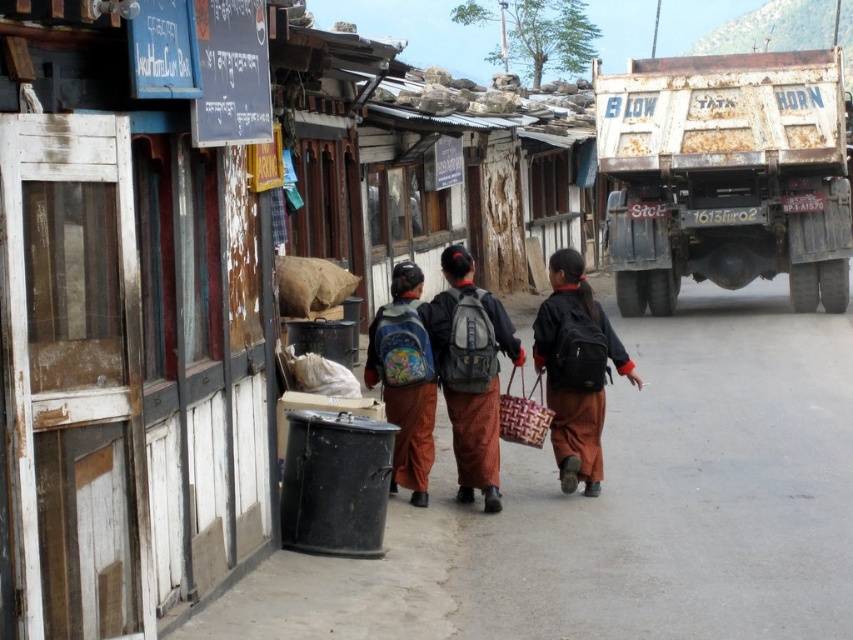
You are a delivery person who needs to place a package on the ground between the rusty metal truck at right and the matte black backpacks at center. Based on the scene description, where should you place the package so it is closer to the truck?

The package should be placed closer to the rusty metal truck at right, which is located to the right of the matte black backpacks at center. Since the truck is to the right of the backpacks, placing the package near the truck ensures it is closer to the truck than the backpacks.

You are standing at the point marked as point (622, 508) in the image. What material are you currently standing on?

You are standing on brown fabric at center.

You are a delivery person standing at the camera position. The rusty metal truck at right is where you need to deliver a package. Can you walk straight to the truck without any obstacles?

The rusty metal truck at right is 39.40 feet away from the camera. Since the path is clear and there are no mentioned obstacles in the scene description, you can walk straight to the truck.